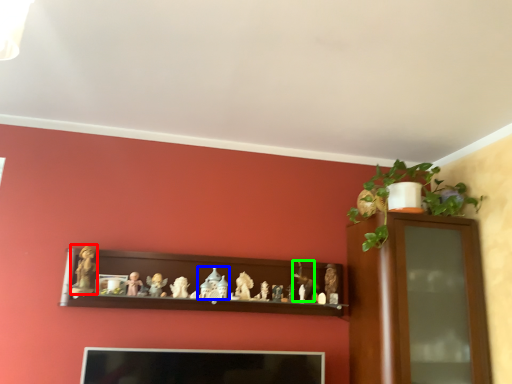
Question: Considering the real-world distances, which object is closest to toy (highlighted by a red box)? toy (highlighted by a blue box) or toy (highlighted by a green box).

Choices:
 (A) toy
 (B) toy

Answer: (A)